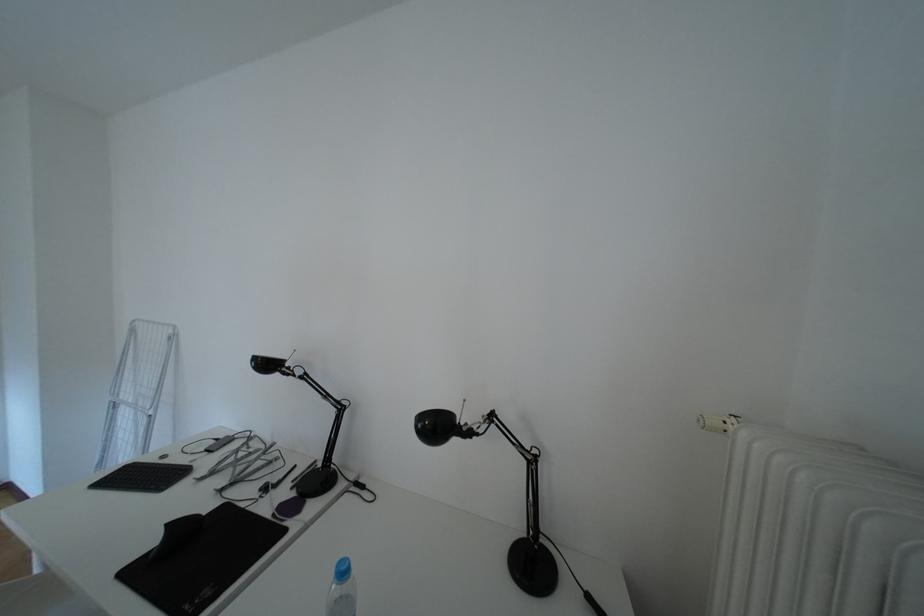
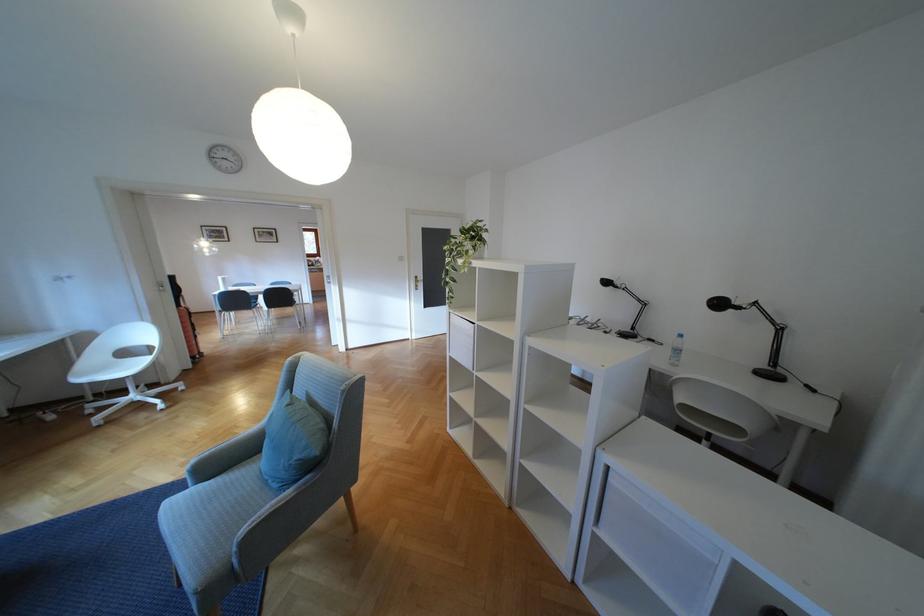
Where in the second image is the point corresponding to point 276,366 from the first image?

(616, 284)